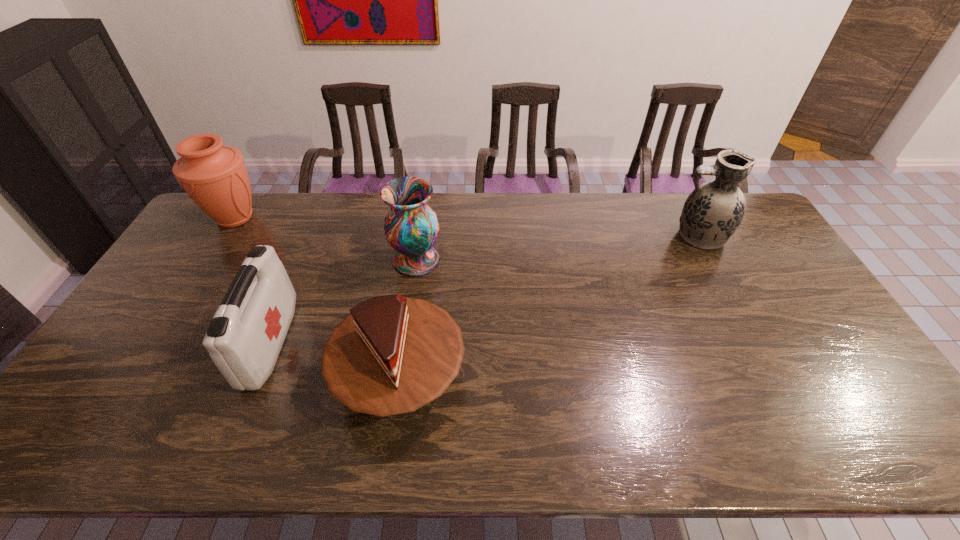
Identify the location of free location located on the front side of the first-aid kit. Image resolution: width=960 pixels, height=540 pixels. (387, 343).

At what (x,y) coordinates should I click in order to perform the action: click on vacant space located 0.230m on the right of the cake. Please return your answer as a coordinate pair (x, y). The height and width of the screenshot is (540, 960). Looking at the image, I should click on (556, 379).

Identify the location of object that is at the near edge. (393, 354).

The height and width of the screenshot is (540, 960). What are the coordinates of `object that is positioned at the left edge` in the screenshot? It's located at (214, 176).

At what (x,y) coordinates should I click in order to perform the action: click on object at the right edge. Please return your answer as a coordinate pair (x, y). Looking at the image, I should click on (713, 211).

Image resolution: width=960 pixels, height=540 pixels. I want to click on object at the far left corner, so click(x=214, y=176).

Find the location of a particular element. The width and height of the screenshot is (960, 540). object located at the far right corner is located at coordinates (713, 211).

Identify the location of vacant space at the far edge of the desktop. (291, 210).

The image size is (960, 540). In order to click on vacant area at the near edge in this screenshot , I will do `click(165, 434)`.

Identify the location of vacant space at the left edge of the desktop. pyautogui.click(x=194, y=309).